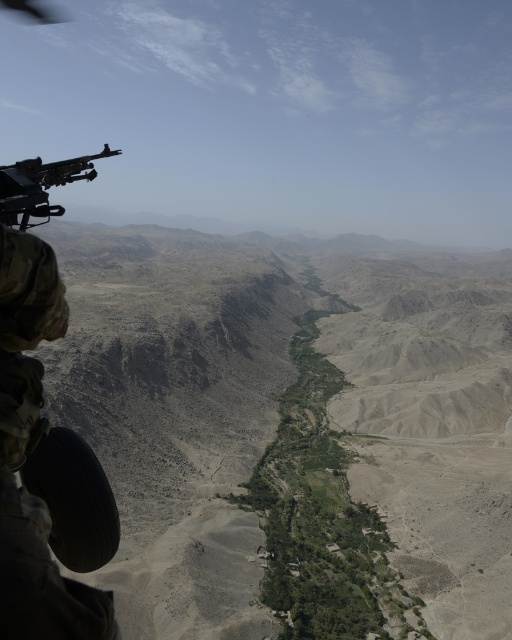
You are a photographer trying to capture the entire scene in one shot. Given that your camera can only focus on objects wider than 10 cm, will both the camouflage fabric helmet at left and the polished metal machine gun at upper left be in focus?

The camouflage fabric helmet at left is narrower than the polished metal machine gun at upper left. Since the camera requires objects to be wider than 10 cm to focus, it is uncertain whether both will be in focus without knowing their exact widths. However, if the machine gun is wider than 10 cm, the helmet might still be too narrow to focus on.

You are a drone operator flying a drone over the arid landscape. You need to drop a supply package at the point closer to the camera between the two points labeled point (x=36, y=428) and point (x=50, y=170). Which point should you target?

You should target point (x=36, y=428) because it is closer to the camera than point (x=50, y=170).

You are a drone operator controlling a drone that is 0.5 meters wide. You need to fly the drone from your current position to the point at coordinates point [13,442]. Can the drone safely navigate to that point without colliding with any obstacles?

The point [13,442] is 5.50 meters from the viewer. Since the drone is 0.5 meters wide, it can safely navigate to that point as there are no obstacles mentioned in the scene description that would interfere with its path.